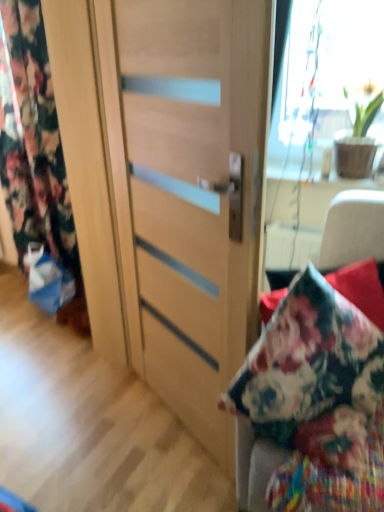
Image resolution: width=384 pixels, height=512 pixels. Describe the element at coordinates (357, 141) in the screenshot. I see `green matte plant at upper right` at that location.

This screenshot has height=512, width=384. Describe the element at coordinates (188, 191) in the screenshot. I see `matte wood door at center` at that location.

This screenshot has width=384, height=512. What are the coordinates of `floral fabric curtain at left` in the screenshot? It's located at (32, 139).

Where is `green matte plant at upper right`? This screenshot has width=384, height=512. green matte plant at upper right is located at coordinates (357, 141).

Looking at this image, from the image's perspective, who appears lower, floral fabric curtain at left or green matte plant at upper right?

green matte plant at upper right.

Can you confirm if floral fabric curtain at left is thinner than green matte plant at upper right?

Yes, floral fabric curtain at left is thinner than green matte plant at upper right.

Is point (27, 45) more distant than point (376, 104)?

That is True.

Are floral fabric curtain at left and green matte plant at upper right making contact?

No, floral fabric curtain at left is not touching green matte plant at upper right.

Which object is positioned more to the right, wooden cabinet at center or matte wood door at center?

From the viewer's perspective, wooden cabinet at center appears more on the right side.

Between wooden cabinet at center and matte wood door at center, which one has larger size?

With larger size is matte wood door at center.

Considering their positions, is wooden cabinet at center located in front of or behind matte wood door at center?

wooden cabinet at center is positioned closer to the viewer than matte wood door at center.

From the picture: How many degrees apart are the facing directions of wooden cabinet at center and matte wood door at center?

They differ by 74.3 degrees in their facing directions.

Which is nearer, (212,185) or (255,489)?

Positioned in front is point (255,489).

Between matte wood door at center and wooden cabinet at center, which one has larger width?

wooden cabinet at center is wider.

Is matte wood door at center closer to camera compared to wooden cabinet at center?

That is False.

Which object is closer to the camera taking this photo, floral fabric curtain at left or wooden cabinet at center?

wooden cabinet at center is more forward.

Would you say floral fabric curtain at left is inside or outside wooden cabinet at center?

floral fabric curtain at left is not inside wooden cabinet at center, it's outside.

Is point (9, 77) closer to viewer compared to point (364, 229)?

No, it is behind (364, 229).

Image resolution: width=384 pixels, height=512 pixels. I want to click on furniture lying on the right of floral fabric curtain at left, so click(x=354, y=227).

Relative to matte wood door at center, is green matte plant at upper right in front or behind?

green matte plant at upper right is positioned farther from the viewer than matte wood door at center.

From a real-world perspective, between green matte plant at upper right and matte wood door at center, who is vertically higher?

green matte plant at upper right is physically above.

From the image's perspective, which object appears higher, green matte plant at upper right or matte wood door at center?

green matte plant at upper right is shown above in the image.

Which object is positioned more to the right, green matte plant at upper right or matte wood door at center?

Positioned to the right is green matte plant at upper right.

Is green matte plant at upper right at the back of wooden cabinet at center?

wooden cabinet at center does not have its back to green matte plant at upper right.

Which object is wider, wooden cabinet at center or green matte plant at upper right?

wooden cabinet at center.

Is wooden cabinet at center closer to camera compared to green matte plant at upper right?

Yes, wooden cabinet at center is closer to the camera.

From the image's perspective, between wooden cabinet at center and green matte plant at upper right, which one is located above?

green matte plant at upper right appears higher in the image.

Would you say wooden cabinet at center is part of green matte plant at upper right's contents?

No, wooden cabinet at center is not inside green matte plant at upper right.

Considering the relative positions of green matte plant at upper right and wooden cabinet at center in the image provided, is green matte plant at upper right to the left or to the right of wooden cabinet at center?

green matte plant at upper right is to the right of wooden cabinet at center.

Consider the image. Which point is more distant from viewer, (360, 173) or (333, 245)?

Positioned behind is point (360, 173).

From a real-world perspective, which is physically below, green matte plant at upper right or wooden cabinet at center?

wooden cabinet at center is physically lower.

The height and width of the screenshot is (512, 384). Identify the location of houseplant on the right of floral fabric curtain at left. (357, 141).

Locate an element on the screen. door that is behind the wooden cabinet at center is located at coordinates coord(188,191).

Which object lies further to the anchor point floral fabric curtain at left, green matte plant at upper right or matte wood door at center?

green matte plant at upper right is further to floral fabric curtain at left.

When comparing their distances from green matte plant at upper right, does matte wood door at center or floral fabric curtain at left seem further?

Based on the image, floral fabric curtain at left appears to be further to green matte plant at upper right.

Based on their spatial positions, is wooden cabinet at center or floral fabric curtain at left further from matte wood door at center?

floral fabric curtain at left is positioned further to the anchor matte wood door at center.

Which object lies nearer to the anchor point green matte plant at upper right, wooden cabinet at center or matte wood door at center?

The object closer to green matte plant at upper right is matte wood door at center.

Based on their spatial positions, is floral fabric curtain at left or wooden cabinet at center further from matte wood door at center?

floral fabric curtain at left lies further to matte wood door at center than the other object.

Estimate the real-world distances between objects in this image. Which object is closer to matte wood door at center, green matte plant at upper right or floral fabric curtain at left?

green matte plant at upper right lies closer to matte wood door at center than the other object.

From the image, which object appears to be farther from matte wood door at center, floral fabric curtain at left or green matte plant at upper right?

floral fabric curtain at left lies further to matte wood door at center than the other object.

Which object lies further to the anchor point wooden cabinet at center, matte wood door at center or green matte plant at upper right?

green matte plant at upper right is positioned further to the anchor wooden cabinet at center.

Where is `door between floral fabric curtain at left and green matte plant at upper right`? door between floral fabric curtain at left and green matte plant at upper right is located at coordinates (188, 191).

This screenshot has height=512, width=384. I want to click on door between wooden cabinet at center and green matte plant at upper right in the front-back direction, so click(x=188, y=191).

Locate an element on the screen. The image size is (384, 512). furniture between floral fabric curtain at left and green matte plant at upper right is located at coordinates (354, 227).

Locate an element on the screen. The width and height of the screenshot is (384, 512). door between wooden cabinet at center and floral fabric curtain at left from front to back is located at coordinates (x=188, y=191).